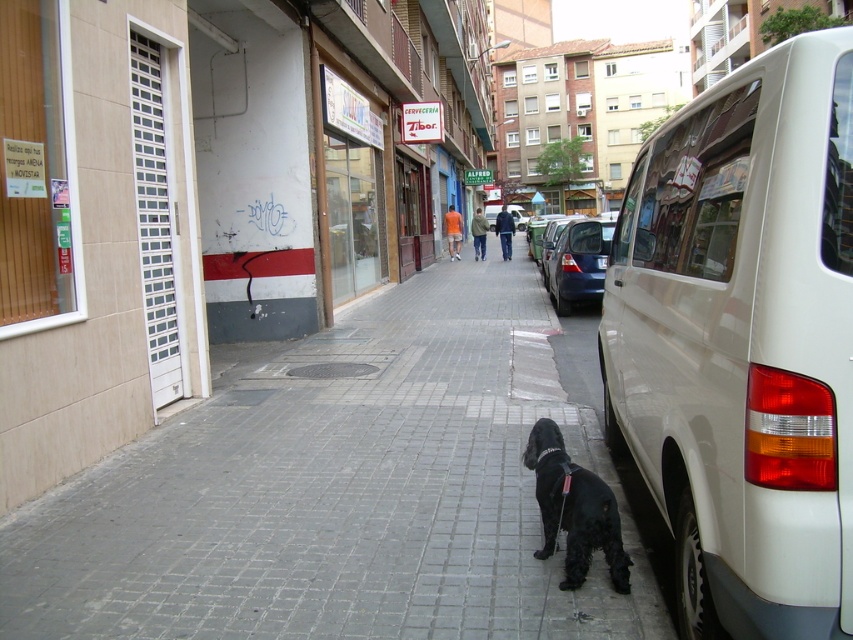
Which is more to the left, gray brick pavement at center or black plastic license plate at right?

gray brick pavement at center

Can you confirm if gray brick pavement at center is wider than black plastic license plate at right?

Yes.

This screenshot has height=640, width=853. What do you see at coordinates (343, 488) in the screenshot? I see `gray brick pavement at center` at bounding box center [343, 488].

Find the location of a particular element. gray brick pavement at center is located at coordinates (343, 488).

Can you confirm if shiny black dog at center is positioned above black plastic van at right?

No.

From the picture: Who is lower down, shiny black dog at center or black plastic van at right?

shiny black dog at center is lower down.

Which is in front, point (582, 497) or point (606, 266)?

Point (582, 497) is in front.

Locate an element on the screen. The image size is (853, 640). shiny black dog at center is located at coordinates (573, 509).

Is point (822, 614) positioned before point (601, 259)?

Yes, it is in front of point (601, 259).

Does point (688, 417) come in front of point (601, 268)?

That is True.

Where is `white glossy van at right`? white glossy van at right is located at coordinates (743, 342).